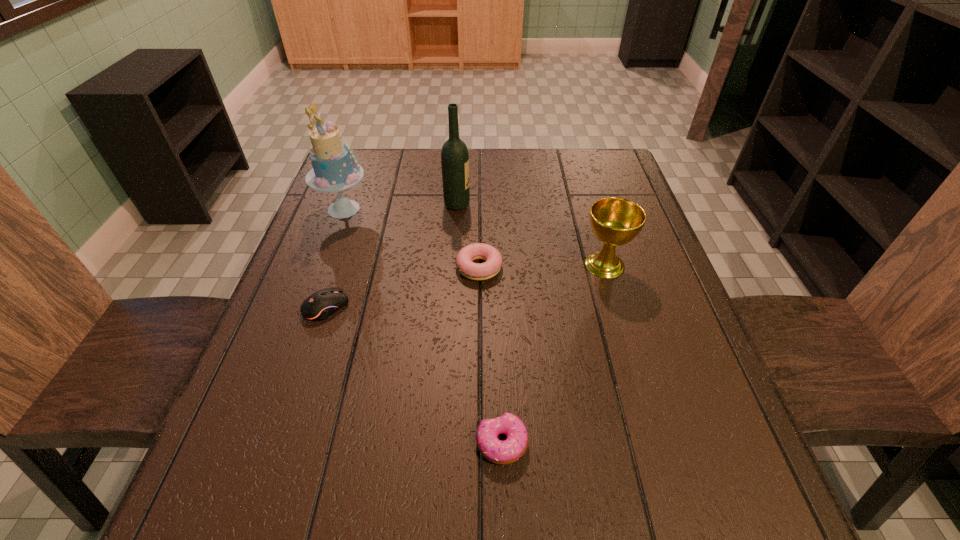
At what (x,y) coordinates should I click in order to perform the action: click on vacant space located on the left of the farther doughnut. Please return your answer as a coordinate pair (x, y). Image resolution: width=960 pixels, height=540 pixels. Looking at the image, I should click on (380, 267).

Locate an element on the screen. The image size is (960, 540). free region located 0.380m on the front of the computer mouse is located at coordinates (257, 521).

The width and height of the screenshot is (960, 540). Identify the location of vacant area situated 0.090m on the right of the nearer doughnut. pyautogui.click(x=581, y=443).

Identify the location of cake that is at the left edge. This screenshot has width=960, height=540. (334, 170).

Identify the location of computer mouse that is at the left edge. (322, 304).

At what (x,y) coordinates should I click in order to perform the action: click on object located in the right edge section of the desktop. Please return your answer as a coordinate pair (x, y). The width and height of the screenshot is (960, 540). Looking at the image, I should click on (615, 221).

At what (x,y) coordinates should I click in order to perform the action: click on vacant area at the far edge. Please return your answer as a coordinate pair (x, y). The height and width of the screenshot is (540, 960). Looking at the image, I should click on (485, 163).

In the image, there is a desktop. Identify the location of blank space at the near edge. The width and height of the screenshot is (960, 540). (516, 509).

The height and width of the screenshot is (540, 960). Identify the location of free space at the left edge of the desktop. (318, 226).

Image resolution: width=960 pixels, height=540 pixels. In order to click on free region at the right edge in this screenshot , I will do coord(621,330).